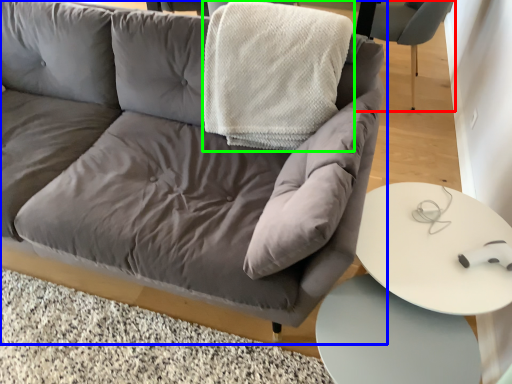
Question: Which is farther away from chair (highlighted by a red box)? studio couch (highlighted by a blue box) or blanket (highlighted by a green box)?

Choices:
 (A) studio couch
 (B) blanket

Answer: (A)